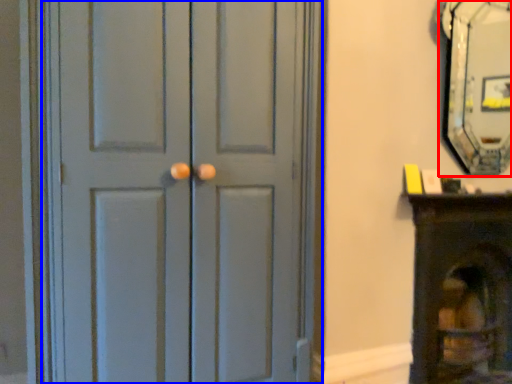
Question: Which object appears farthest to the camera in this image, fireplace (highlighted by a red box) or door (highlighted by a blue box)?

Choices:
 (A) fireplace
 (B) door

Answer: (A)